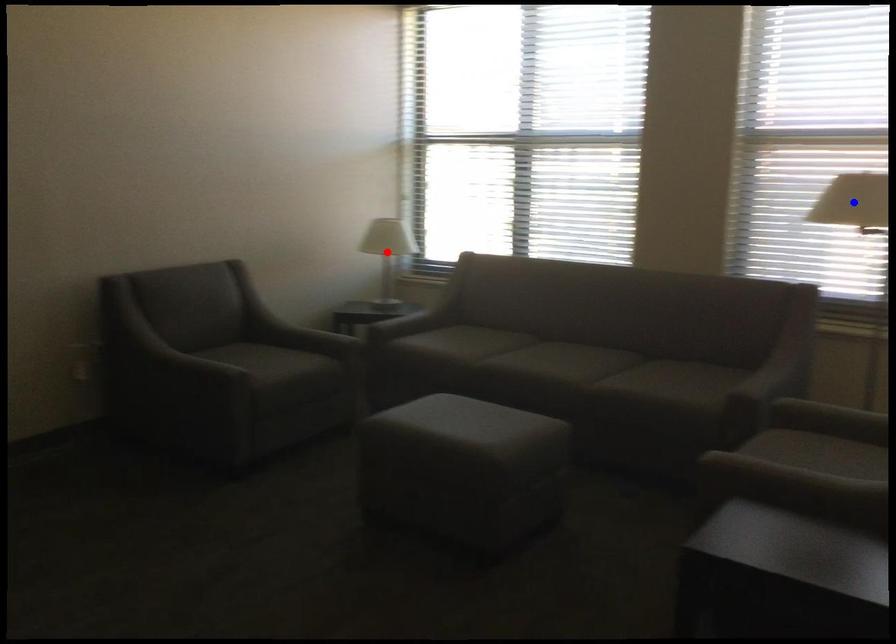
Question: Two points are marked on the image. Which point is closer to the camera?

Choices:
 (A) Blue point is closer.
 (B) Red point is closer.

Answer: (A)